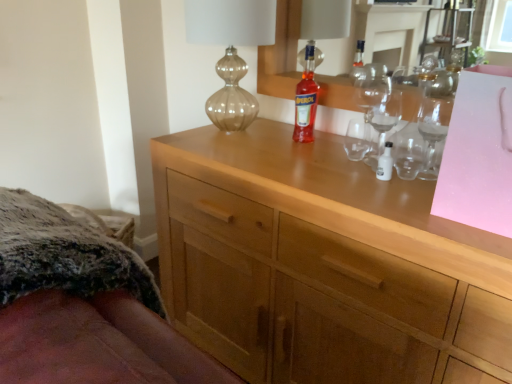
This screenshot has height=384, width=512. What are the coordinates of `free space to the left of translucent glass bottle at center` in the screenshot? It's located at (258, 144).